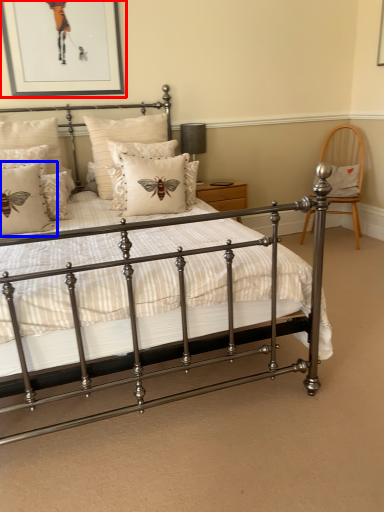
Question: Which object appears closest to the camera in this image, picture frame (highlighted by a red box) or pillow (highlighted by a blue box)?

Choices:
 (A) picture frame
 (B) pillow

Answer: (B)